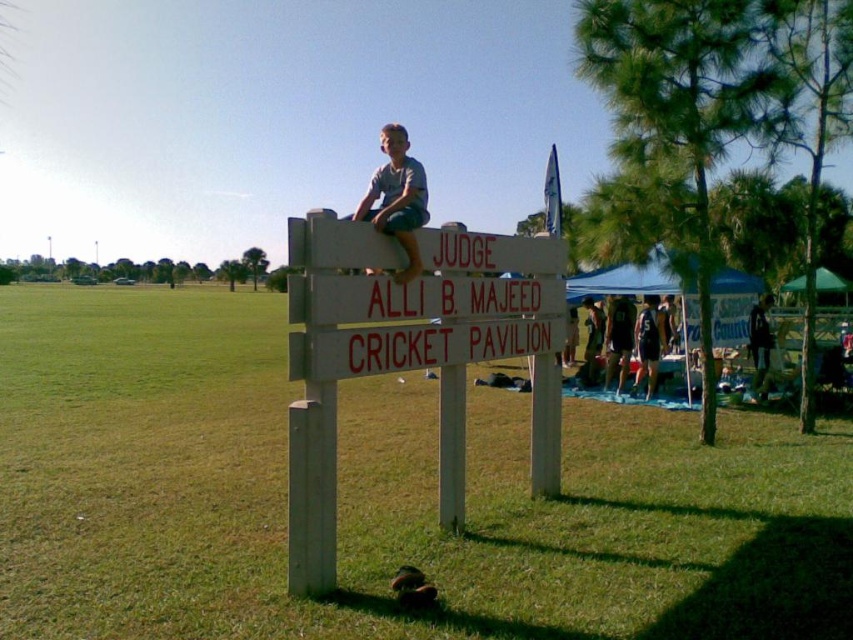
Question: Is white wooden sign at center smaller than gray cotton shirt at upper center?

Choices:
 (A) no
 (B) yes

Answer: (B)

Question: Among these points, which one is farthest from the camera?

Choices:
 (A) (654, 332)
 (B) (733, 570)
 (C) (445, 372)
 (D) (764, 364)

Answer: (D)

Question: Which object appears farthest from the camera in this image?

Choices:
 (A) dark blue jersey at center
 (B) white wood sign at center
 (C) dark blue shirt at center

Answer: (A)

Question: Among these points, which one is nearest to the camera?

Choices:
 (A) (764, 349)
 (B) (637, 380)
 (C) (296, 593)
 (D) (425, 417)

Answer: (C)

Question: Can you confirm if white wooden sign at center is thinner than dark blue jersey at center?

Choices:
 (A) yes
 (B) no

Answer: (B)

Question: Is gray cotton shirt at upper center positioned at the back of dark blue shirt at center?

Choices:
 (A) yes
 (B) no

Answer: (B)